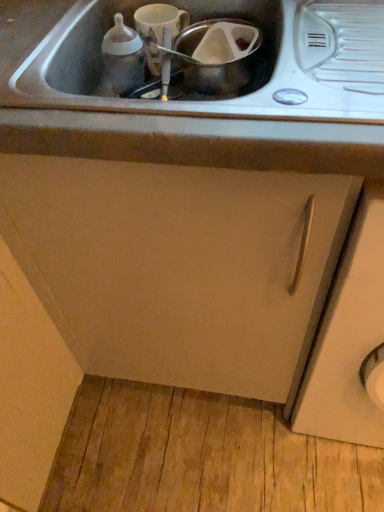
Question: From the image's perspective, would you say transparent plastic container at center, the 1th appliance in the right-to-left sequence, is positioned over stainless steel sink at upper center, the 1th sink viewed from the front?

Choices:
 (A) yes
 (B) no

Answer: (A)

Question: From a real-world perspective, is transparent plastic container at center, which appears as the second appliance when viewed from the left, positioned over stainless steel sink at upper center, the 1th sink viewed from the front, based on gravity?

Choices:
 (A) yes
 (B) no

Answer: (B)

Question: Considering the relative positions of transparent plastic container at center, which appears as the second appliance when viewed from the left, and stainless steel sink at upper center, which ranks as the second sink in back-to-front order, in the image provided, is transparent plastic container at center, which appears as the second appliance when viewed from the left, to the left of stainless steel sink at upper center, which ranks as the second sink in back-to-front order, from the viewer's perspective?

Choices:
 (A) yes
 (B) no

Answer: (B)

Question: From the image's perspective, is transparent plastic container at center, the 1th appliance in the right-to-left sequence, under stainless steel sink at upper center, the 1th sink viewed from the front?

Choices:
 (A) yes
 (B) no

Answer: (B)

Question: Considering the relative sizes of transparent plastic container at center, the 1th appliance in the right-to-left sequence, and stainless steel sink at upper center, the 1th sink viewed from the front, in the image provided, is transparent plastic container at center, the 1th appliance in the right-to-left sequence, thinner than stainless steel sink at upper center, the 1th sink viewed from the front,?

Choices:
 (A) no
 (B) yes

Answer: (B)

Question: Considering the relative positions of transparent plastic container at center, which appears as the second appliance when viewed from the left, and stainless steel sink at upper center, which ranks as the second sink in back-to-front order, in the image provided, is transparent plastic container at center, which appears as the second appliance when viewed from the left, in front of stainless steel sink at upper center, which ranks as the second sink in back-to-front order,?

Choices:
 (A) no
 (B) yes

Answer: (A)

Question: Can you confirm if matte white cabinet at center, which ranks as the first cabinetry in left-to-right order, is shorter than matte white cup at upper center, marked as the second appliance in a right-to-left arrangement?

Choices:
 (A) yes
 (B) no

Answer: (B)

Question: Is matte white cabinet at center, which ranks as the first cabinetry in left-to-right order, positioned behind matte white cup at upper center, marked as the second appliance in a right-to-left arrangement?

Choices:
 (A) no
 (B) yes

Answer: (A)

Question: Does matte white cabinet at center, which ranks as the first cabinetry in left-to-right order, have a larger size compared to matte white cup at upper center, the first appliance when ordered from left to right?

Choices:
 (A) yes
 (B) no

Answer: (A)

Question: From a real-world perspective, is matte white cabinet at center, which ranks as the second cabinetry in right-to-left order, located higher than matte white cup at upper center, the first appliance when ordered from left to right?

Choices:
 (A) no
 (B) yes

Answer: (A)

Question: Would you consider matte white cabinet at center, which ranks as the second cabinetry in right-to-left order, to be distant from matte white cup at upper center, marked as the second appliance in a right-to-left arrangement?

Choices:
 (A) yes
 (B) no

Answer: (B)

Question: Is matte white cabinet at center, which ranks as the first cabinetry in left-to-right order, wider than matte white cup at upper center, marked as the second appliance in a right-to-left arrangement?

Choices:
 (A) yes
 (B) no

Answer: (A)

Question: From the image's perspective, is matte white cup at upper center, the first appliance when ordered from left to right, under metallic stainless steel sink at center, the second sink positioned from the front?

Choices:
 (A) no
 (B) yes

Answer: (A)